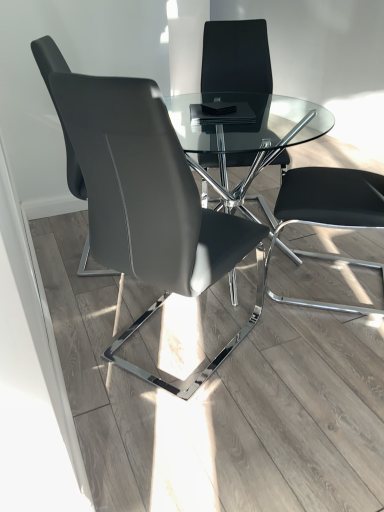
Question: Does matte black chair at left, the 2th chair viewed from the front, have a greater height compared to black leather chair at right?

Choices:
 (A) yes
 (B) no

Answer: (A)

Question: Is matte black chair at left, the 2th chair viewed from the front, positioned behind black leather chair at right?

Choices:
 (A) no
 (B) yes

Answer: (B)

Question: From the image's perspective, does matte black chair at left, which is the second chair in back-to-front order, appear higher than black leather chair at right?

Choices:
 (A) yes
 (B) no

Answer: (A)

Question: Can you confirm if matte black chair at left, the 2th chair viewed from the front, is positioned to the right of black leather chair at right?

Choices:
 (A) no
 (B) yes

Answer: (A)

Question: From the image's perspective, is matte black chair at center, placed as the first chair when sorted from front to back, positioned above or below black leather chair at center, which is counted as the first chair, starting from the back?

Choices:
 (A) above
 (B) below

Answer: (B)

Question: From a real-world perspective, relative to black leather chair at center, which is counted as the first chair, starting from the back, is matte black chair at center, placed as the first chair when sorted from front to back, vertically above or below?

Choices:
 (A) below
 (B) above

Answer: (B)

Question: Does point (157, 377) appear closer or farther from the camera than point (213, 53)?

Choices:
 (A) closer
 (B) farther

Answer: (A)

Question: From their relative heights in the image, would you say matte black chair at center, placed as the first chair when sorted from front to back, is taller or shorter than black leather chair at center, which is counted as the first chair, starting from the back?

Choices:
 (A) tall
 (B) short

Answer: (B)

Question: In terms of width, does black leather chair at center, which is counted as the first chair, starting from the back, look wider or thinner when compared to matte black chair at left, the 2th chair viewed from the front?

Choices:
 (A) thin
 (B) wide

Answer: (B)

Question: Considering the positions of black leather chair at center, which is counted as the third chair, starting from the front, and matte black chair at left, which is the second chair in back-to-front order, in the image, is black leather chair at center, which is counted as the third chair, starting from the front, taller or shorter than matte black chair at left, which is the second chair in back-to-front order,?

Choices:
 (A) short
 (B) tall

Answer: (B)

Question: Based on their positions, is black leather chair at center, which is counted as the third chair, starting from the front, located to the left or right of matte black chair at left, the 2th chair viewed from the front?

Choices:
 (A) right
 (B) left

Answer: (A)

Question: Is black leather chair at center, which is counted as the first chair, starting from the back, spatially inside matte black chair at left, which is the second chair in back-to-front order, or outside of it?

Choices:
 (A) inside
 (B) outside

Answer: (B)

Question: Is black leather chair at right taller or shorter than matte black chair at center, positioned as the third chair in back-to-front order?

Choices:
 (A) short
 (B) tall

Answer: (A)

Question: Would you say black leather chair at right is to the left or to the right of matte black chair at center, positioned as the third chair in back-to-front order, in the picture?

Choices:
 (A) right
 (B) left

Answer: (A)